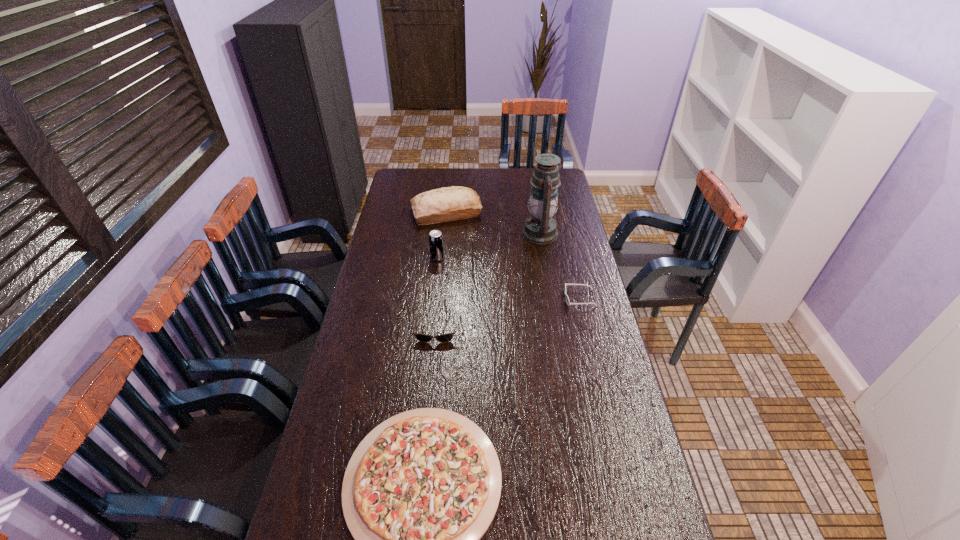
Locate an element on the screen. This screenshot has height=540, width=960. the tallest object is located at coordinates (540, 228).

Find the location of `soda can`. soda can is located at coordinates (436, 244).

Where is `bread`? The width and height of the screenshot is (960, 540). bread is located at coordinates (445, 204).

In order to click on the nearer sunglasses in this screenshot , I will do `click(447, 337)`.

Locate an element on the screen. the fifth farthest object is located at coordinates (447, 337).

Identify the location of the right sunglasses. (567, 299).

At what (x,y) coordinates should I click in order to perform the action: click on the farther sunglasses. Please return your answer as a coordinate pair (x, y). The image size is (960, 540). Looking at the image, I should click on (567, 299).

I want to click on vacant space located 0.220m on the front of the oil lamp, so click(551, 285).

Find the location of `vacant region located 0.150m on the back of the soda can`. vacant region located 0.150m on the back of the soda can is located at coordinates (441, 232).

Where is `vacant space positioned 0.390m on the front of the bread`? The height and width of the screenshot is (540, 960). vacant space positioned 0.390m on the front of the bread is located at coordinates (440, 285).